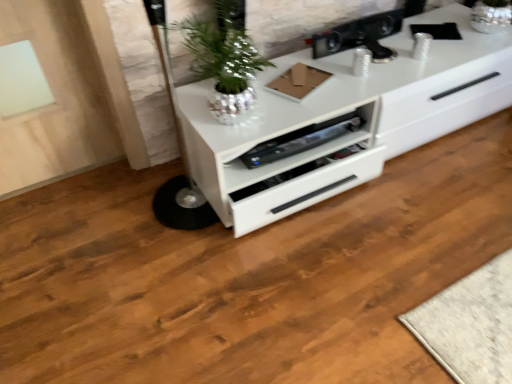
The image size is (512, 384). Find the location of `free spot below metallic black speaker at upper center, arranged as the first appliance when viewed from the top (from a real-world perspective)`. free spot below metallic black speaker at upper center, arranged as the first appliance when viewed from the top (from a real-world perspective) is located at coordinates (357, 48).